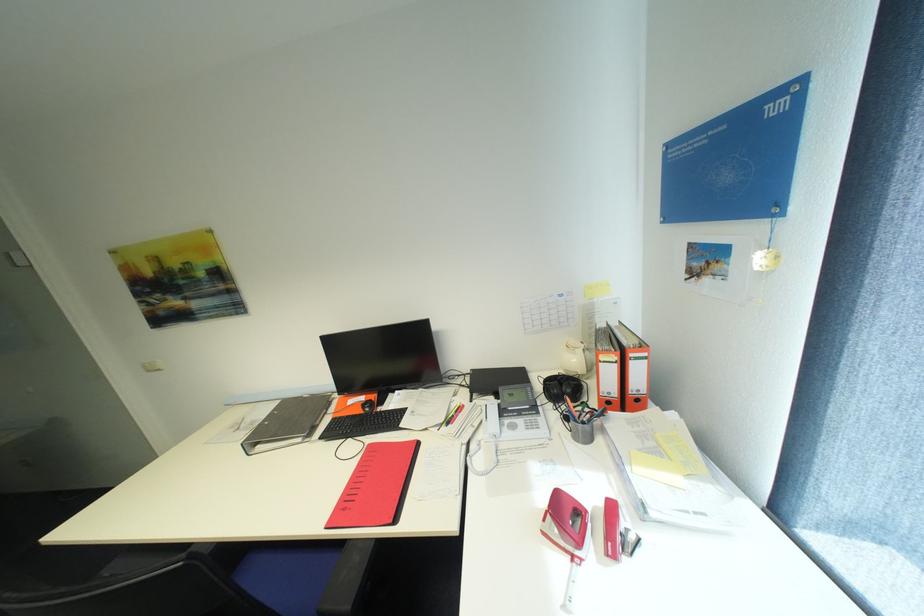
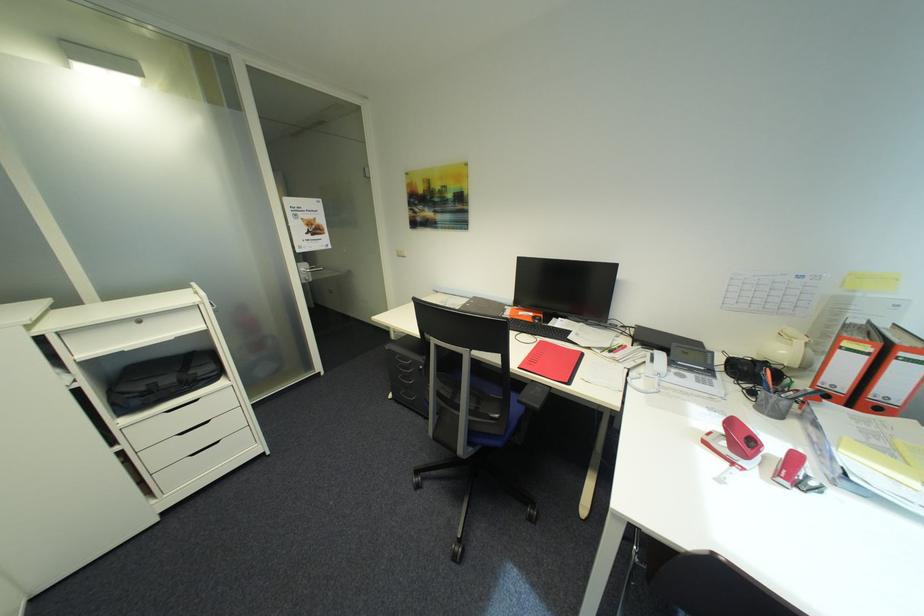
In the second image, find the point that corresponds to [580,557] in the first image.

(742, 464)